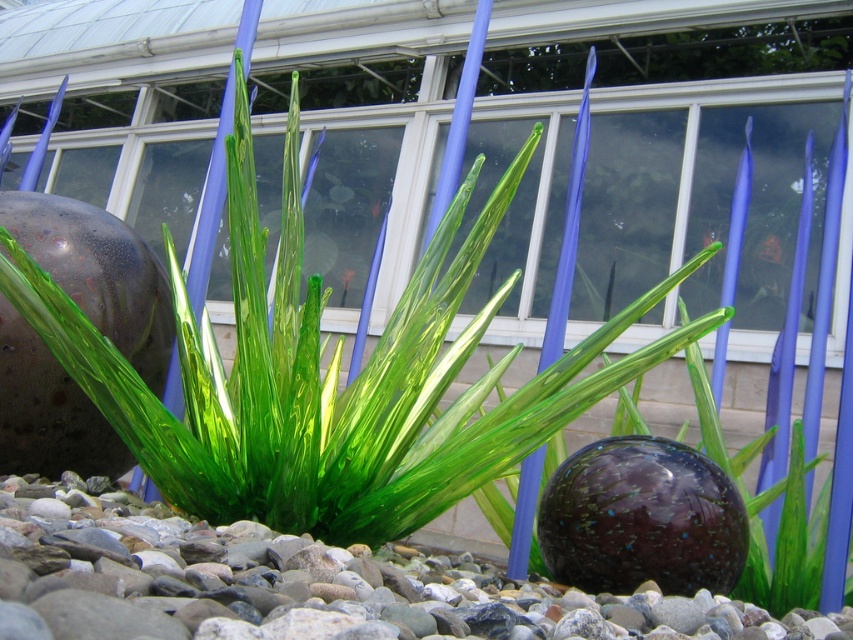
Which is in front, point (337, 456) or point (115, 520)?

Point (115, 520) is in front.

Who is taller, green glass plant at center or smooth pebbles at center?

Standing taller between the two is green glass plant at center.

Which is behind, point (177, 472) or point (161, 566)?

Point (177, 472)

The image size is (853, 640). In order to click on green glass plant at center in this screenshot , I will do `click(332, 376)`.